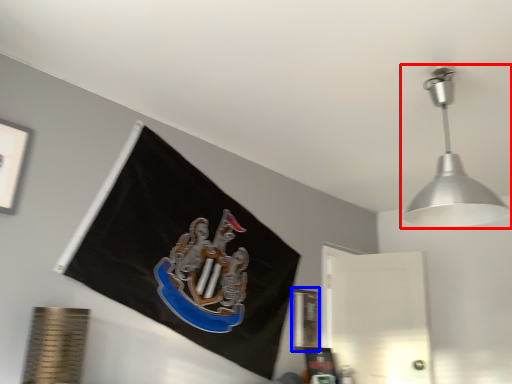
Question: Which point is further to the camera, lamp (highlighted by a red box) or picture frame (highlighted by a blue box)?

Choices:
 (A) lamp
 (B) picture frame

Answer: (B)